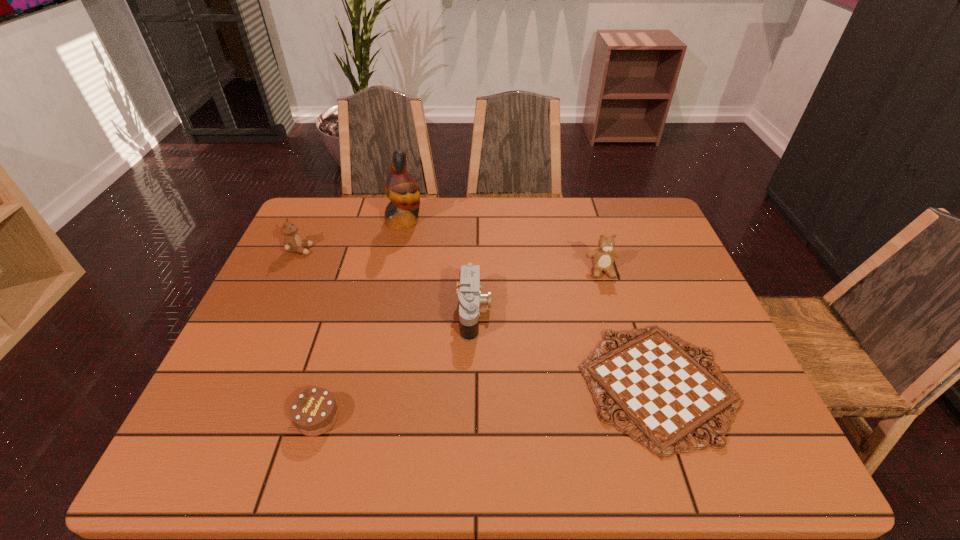
Where is `object at the left edge`? The image size is (960, 540). object at the left edge is located at coordinates (292, 242).

The width and height of the screenshot is (960, 540). Find the location of `object at the right edge`. object at the right edge is located at coordinates (667, 395).

At what (x,y) coordinates should I click in order to perform the action: click on object that is at the far left corner. Please return your answer as a coordinate pair (x, y). The height and width of the screenshot is (540, 960). Looking at the image, I should click on (292, 242).

This screenshot has height=540, width=960. Identify the location of object that is positioned at the near right corner. (667, 395).

In the image, there is a desktop. Identify the location of vacant space at the far edge. This screenshot has width=960, height=540. (500, 222).

Identify the location of vacant space at the near edge of the desktop. (386, 469).

Image resolution: width=960 pixels, height=540 pixels. Find the location of `free space at the left edge`. free space at the left edge is located at coordinates (276, 324).

Locate an element on the screen. The height and width of the screenshot is (540, 960). vacant space at the far left corner of the desktop is located at coordinates (341, 200).

Image resolution: width=960 pixels, height=540 pixels. I want to click on vacant area at the near left corner, so click(x=260, y=463).

At what (x,y) coordinates should I click in order to perform the action: click on free space between the parrot and the fourth nearest object. Please return your answer as a coordinate pair (x, y). Image resolution: width=960 pixels, height=540 pixels. Looking at the image, I should click on (503, 246).